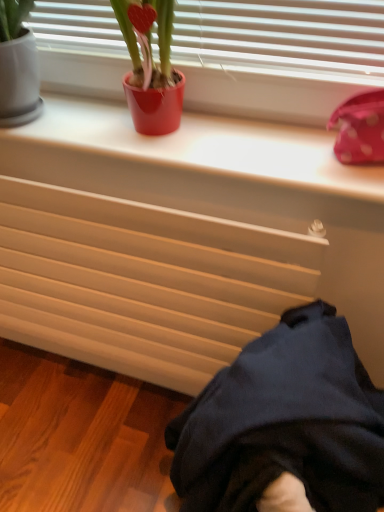
Where is `free space to the left of shiny red pot at upper center`? free space to the left of shiny red pot at upper center is located at coordinates (72, 120).